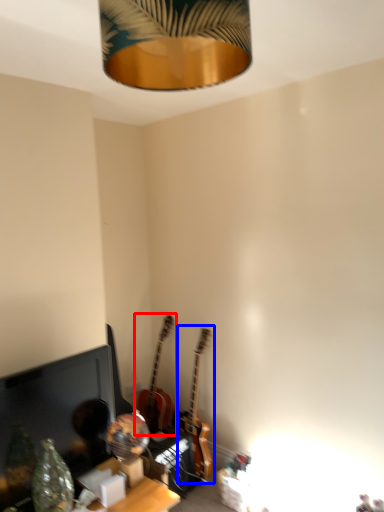
Question: Which of the following is the closest to the observer, guitar (highlighted by a red box) or guitar (highlighted by a blue box)?

Choices:
 (A) guitar
 (B) guitar

Answer: (B)